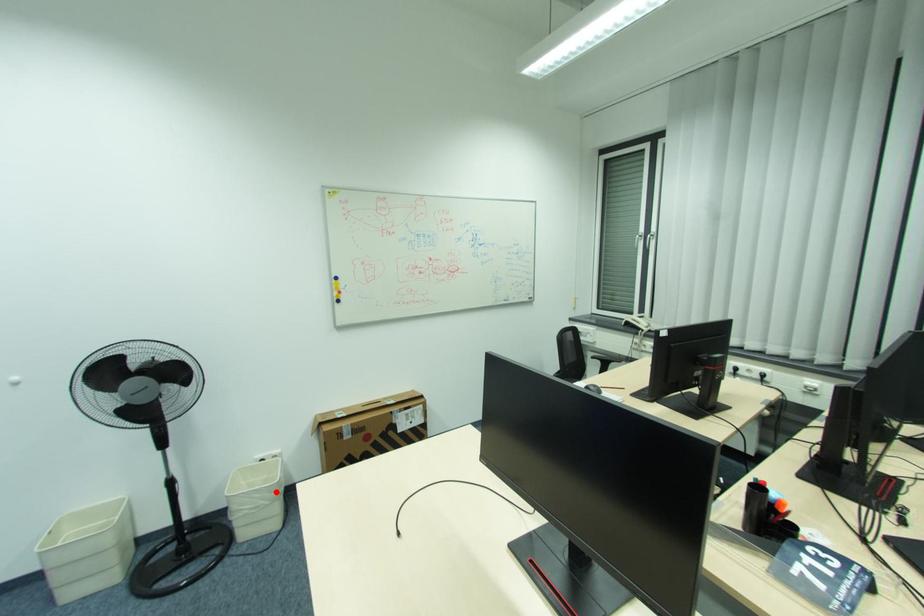
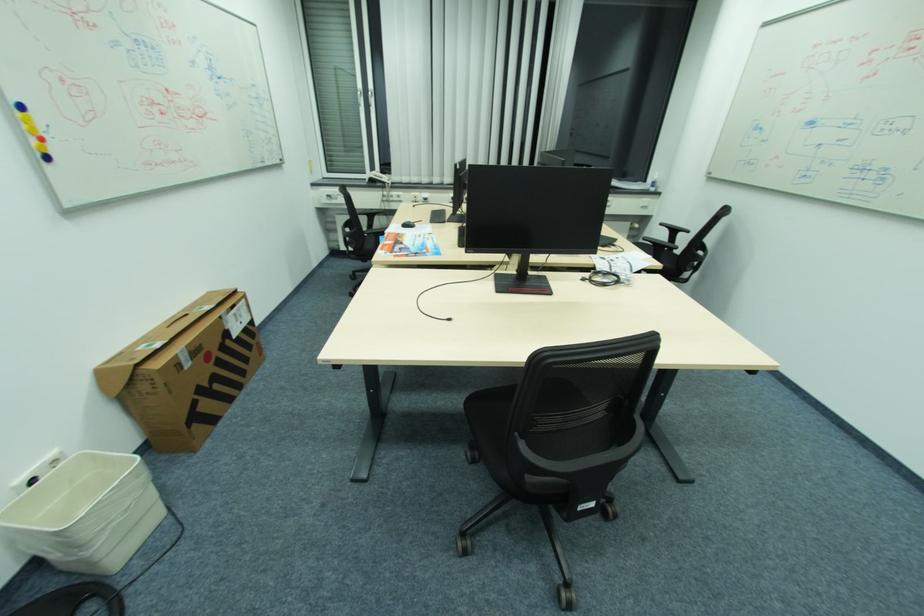
In the second image, find the point that corresponds to the highlighted location in the first image.

(143, 476)